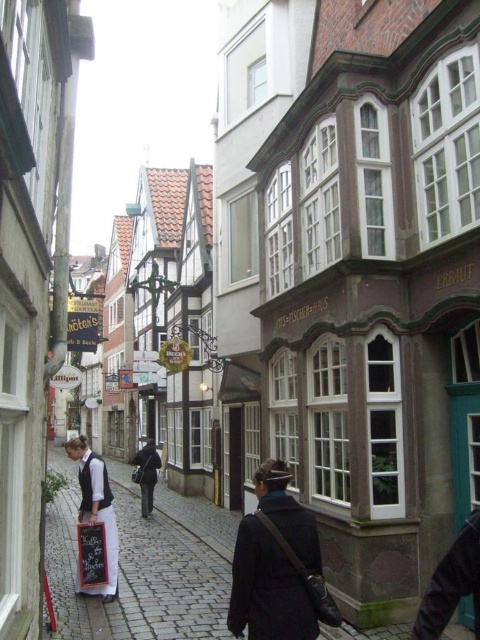
In the scene shown: You are a tourist walking down the cobblestone street and you see a dark blue coat at center and a white linen apron at lower left. Which item is larger in size?

The white linen apron at lower left is larger than the dark blue coat at center.

You are a delivery person standing at the entrance of the cobblestone street. You need to deliver a package to the dark gray coat at center. There is a white linen apron at lower left blocking the path. Can you walk around it without getting too close? Explain your reasoning.

The white linen apron at lower left is 79.89 feet away from the dark gray coat at center. Since the apron is quite far from the coat, you can easily walk around it without getting too close.